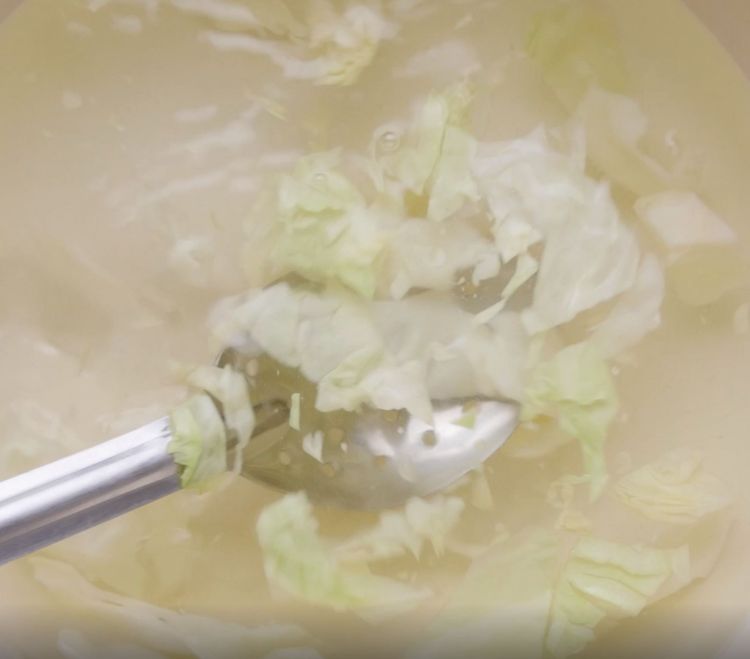
At what (x,y) coordinates should I click in order to perform the action: click on metal handle. Please return your answer as a coordinate pair (x, y). Image resolution: width=750 pixels, height=659 pixels. Looking at the image, I should click on (93, 493).